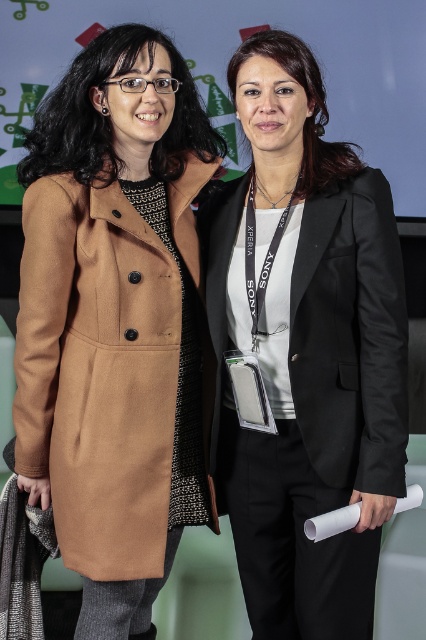
Question: Among these points, which one is farthest from the camera?

Choices:
 (A) (348, 428)
 (B) (152, 272)

Answer: (B)

Question: Can you confirm if matte brown coat at left is thinner than black satin blazer at right?

Choices:
 (A) yes
 (B) no

Answer: (B)

Question: Is matte brown coat at left smaller than black satin blazer at right?

Choices:
 (A) yes
 (B) no

Answer: (B)

Question: In this image, where is matte brown coat at left located relative to black satin blazer at right?

Choices:
 (A) above
 (B) below

Answer: (B)